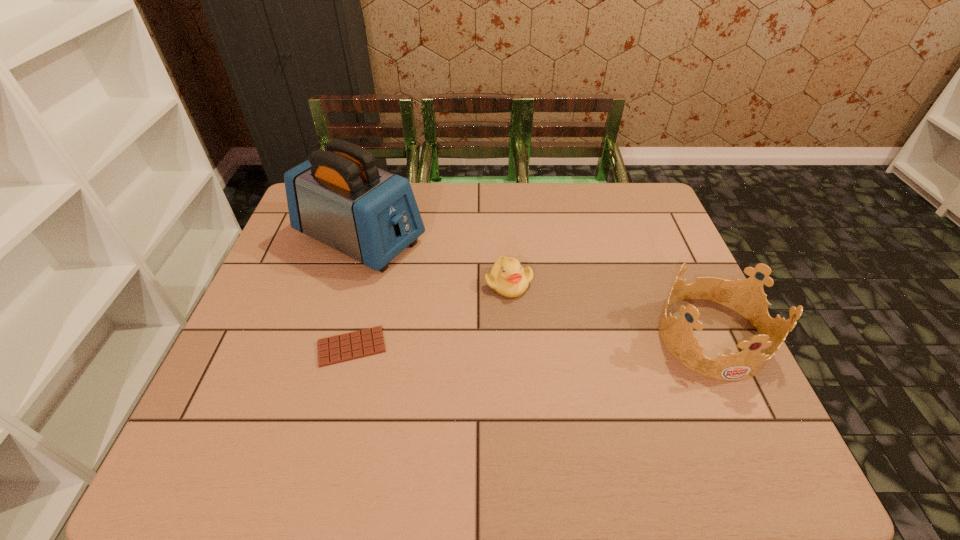
Find the location of a particular element. vacant area between the duckling and the toaster is located at coordinates click(435, 261).

This screenshot has height=540, width=960. Find the location of `empty space between the rightmost object and the toaster`. empty space between the rightmost object and the toaster is located at coordinates (536, 287).

This screenshot has width=960, height=540. I want to click on vacant region between the shortest object and the tallest object, so click(x=356, y=293).

Locate which object ranks second in proximity to the second shortest object. Please provide its 2D coordinates. Your answer should be formatted as a tuple, i.e. [(x, y)], where the tuple contains the x and y coordinates of a point satisfying the conditions above.

[(349, 346)]

The width and height of the screenshot is (960, 540). Find the location of `object that is the third closest to the tiara`. object that is the third closest to the tiara is located at coordinates (349, 346).

The width and height of the screenshot is (960, 540). What are the coordinates of `vacant space that satisfies the following two spatial constraints: 1. on the front side of the tallest object; 2. on the left side of the shortest object` in the screenshot? It's located at (328, 347).

Image resolution: width=960 pixels, height=540 pixels. In order to click on vacant region that satisfies the following two spatial constraints: 1. on the front side of the shortest object; 2. on the left side of the tallest object in this screenshot , I will do `click(328, 347)`.

The height and width of the screenshot is (540, 960). I want to click on vacant space that satisfies the following two spatial constraints: 1. on the front side of the toaster; 2. on the right side of the shortest object, so click(328, 347).